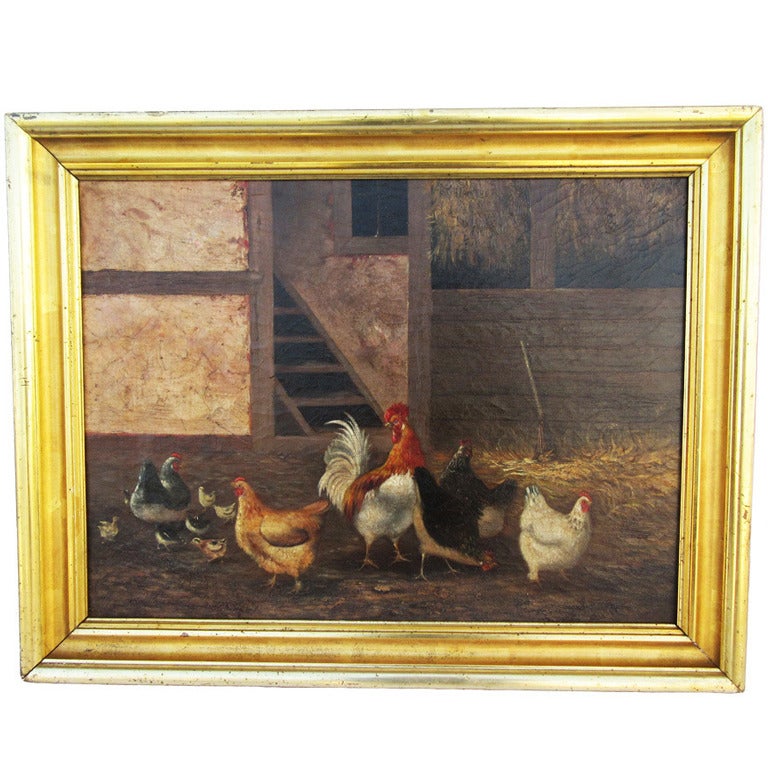
This screenshot has height=768, width=768. I want to click on wall, so click(x=564, y=358), click(x=174, y=341), click(x=346, y=280).